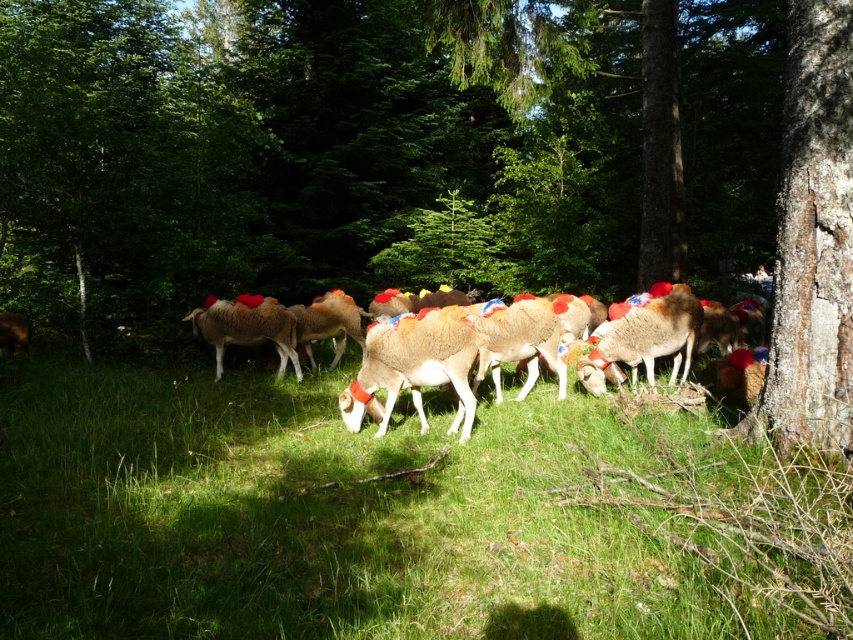
You are standing in the forest and see the scene. There is a point marked at coordinates (x=428, y=161). What object in the scene corresponds to this point?

The point at coordinates (x=428, y=161) corresponds to the brown rough tree at center right.